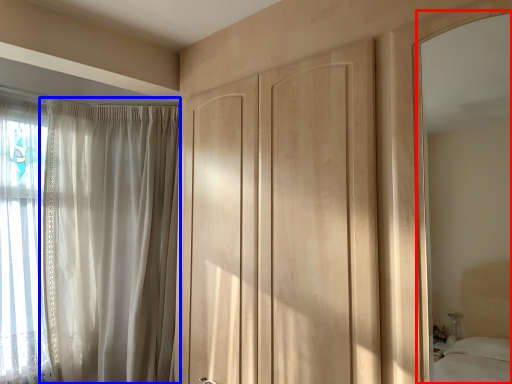
Question: Which of the following is the farthest to the observer, mirror (highlighted by a red box) or curtain (highlighted by a blue box)?

Choices:
 (A) mirror
 (B) curtain

Answer: (B)